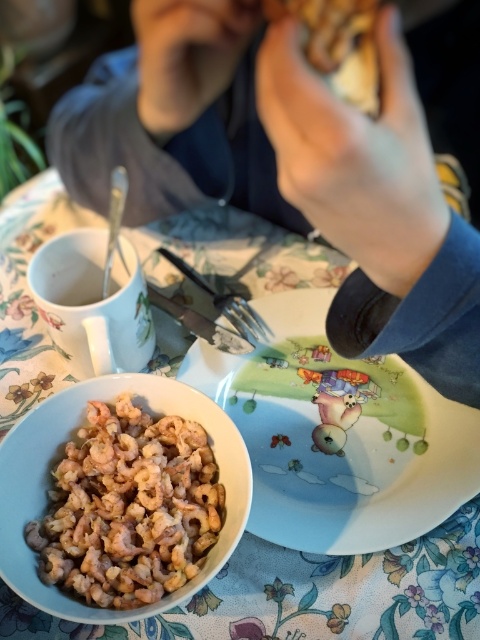
You are a chef preparing a dish and need to place a garnish between the matte ceramic plate at center and the silver metallic fork at center. Given that the space between them is 3.87 inches, will a 2.5 inch wide garnish fit without overlapping either object?

The space between the matte ceramic plate at center and the silver metallic fork at center is 3.87 inches. Since the garnish is only 2.5 inches wide, there will be enough space to place it between them without overlapping either object.

You are setting up a small dinner for two and need to place a silver metallic fork at center on the table. The matte ceramic plate at center must also be placed. Given their sizes, which object should be placed first to ensure both fit properly?

The matte ceramic plate at center is bigger than the silver metallic fork at center, so you should place the matte ceramic plate at center first to ensure there is enough space for both items.

You are a chef preparing a dish and need to place the silver metallic fork at center on the table. However, there is a smooth skin hand at upper right reaching towards the same area. Based on their positions, will the hand interfere with placing the fork?

The smooth skin hand at upper right is much taller than the silver metallic fork at center, so placing the fork might be obstructed by the hand.